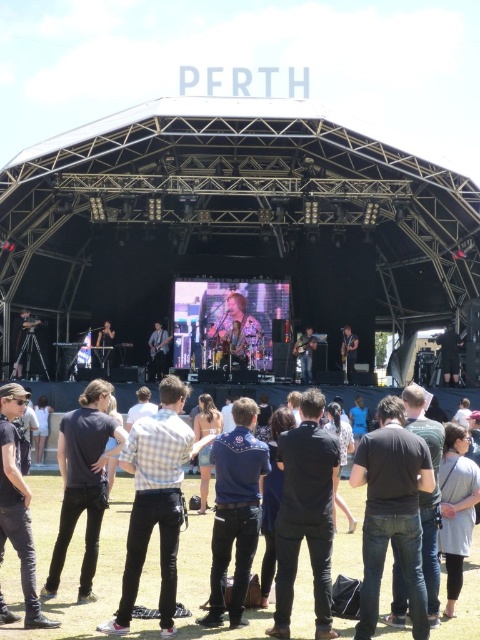
You are a photographer at the concert and want to capture a photo of both the black leather jacket at lower left and the green fabric guitar at center. Since you want both items to be clearly visible, which object should you focus on first to ensure sharpness?

The black leather jacket at lower left is closer to the viewer than the green fabric guitar at center, so focusing on the black leather jacket at lower left first will ensure both are in focus as it is the closer object.

You are a photographer at the concert and want to capture a photo of the performer wearing both black denim jeans at center and dark blue shirt at center. Which clothing item is lower in the photo?

The black denim jeans at center is positioned under the dark blue shirt at center, so the jeans are lower in the photo.